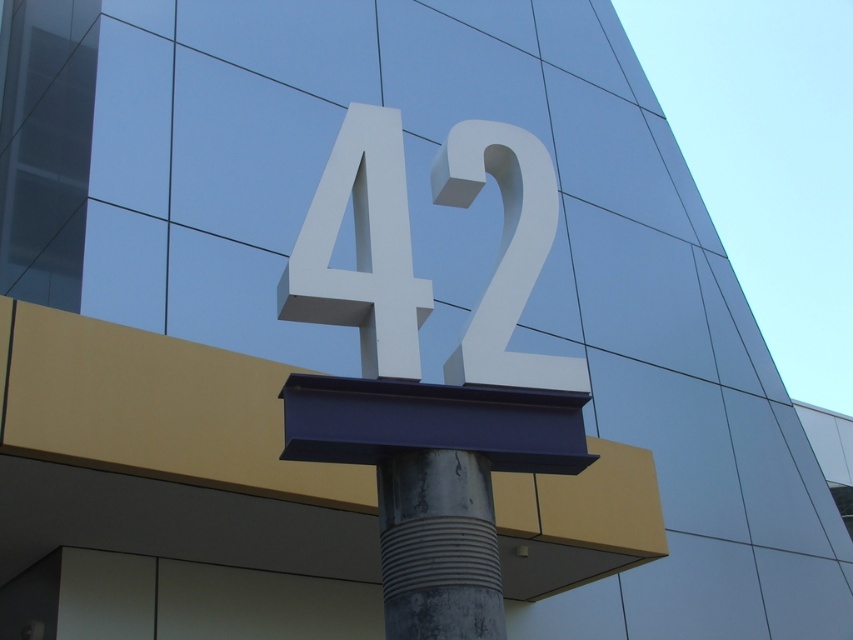
Question: Observing the image, what is the correct spatial positioning of white matte number at center in reference to white glossy number at center?

Choices:
 (A) left
 (B) right

Answer: (A)

Question: Is white matte number at center thinner than rusty metallic pole at center?

Choices:
 (A) no
 (B) yes

Answer: (A)

Question: Observing the image, what is the correct spatial positioning of rusty metallic pole at center in reference to white glossy number at center?

Choices:
 (A) right
 (B) left

Answer: (B)

Question: Among these objects, which one is farthest from the camera?

Choices:
 (A) white matte number at center
 (B) rusty metallic pole at center
 (C) white glossy number at center

Answer: (C)

Question: Which object appears closest to the camera in this image?

Choices:
 (A) white matte number at center
 (B) rusty metallic pole at center

Answer: (B)

Question: Which object is farther from the camera taking this photo?

Choices:
 (A) rusty metallic pole at center
 (B) white matte number at center

Answer: (B)